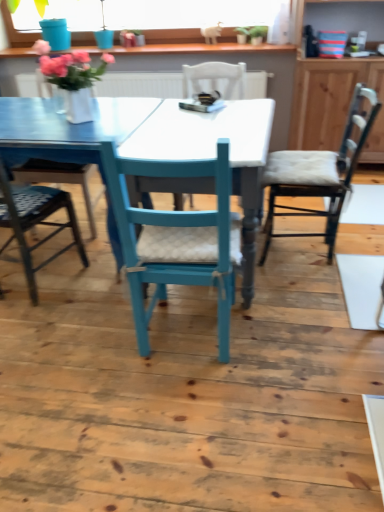
Question: Is matte blue swivel chair at left positioned in front of wooden cabinet at right?

Choices:
 (A) yes
 (B) no

Answer: (A)

Question: From the image's perspective, is matte blue swivel chair at left on top of wooden cabinet at right?

Choices:
 (A) no
 (B) yes

Answer: (A)

Question: Does matte blue swivel chair at left lie behind wooden cabinet at right?

Choices:
 (A) yes
 (B) no

Answer: (B)

Question: Can you confirm if matte blue swivel chair at left is shorter than wooden cabinet at right?

Choices:
 (A) yes
 (B) no

Answer: (A)

Question: Is matte blue swivel chair at left thinner than wooden cabinet at right?

Choices:
 (A) no
 (B) yes

Answer: (A)

Question: Is matte blue swivel chair at left not near wooden cabinet at right?

Choices:
 (A) no
 (B) yes

Answer: (B)

Question: From a real-world perspective, is matte blue swivel chair at left on wooden textured chair at right, which is the first chair in right-to-left order?

Choices:
 (A) yes
 (B) no

Answer: (A)

Question: Does matte blue swivel chair at left have a lesser height compared to wooden textured chair at right, which appears as the third chair when viewed from the left?

Choices:
 (A) yes
 (B) no

Answer: (B)

Question: Does matte blue swivel chair at left have a smaller size compared to wooden textured chair at right, which appears as the third chair when viewed from the left?

Choices:
 (A) yes
 (B) no

Answer: (B)

Question: Considering the relative sizes of matte blue swivel chair at left and wooden textured chair at right, which is the first chair in right-to-left order, in the image provided, is matte blue swivel chair at left wider than wooden textured chair at right, which is the first chair in right-to-left order,?

Choices:
 (A) yes
 (B) no

Answer: (A)

Question: From the image's perspective, is matte blue swivel chair at left below wooden textured chair at right, which appears as the third chair when viewed from the left?

Choices:
 (A) no
 (B) yes

Answer: (A)

Question: From a real-world perspective, is matte blue swivel chair at left physically below wooden textured chair at right, which is the first chair in right-to-left order?

Choices:
 (A) no
 (B) yes

Answer: (A)

Question: Does wooden textured chair at right, which is the first chair in right-to-left order, have a greater width compared to green matte plant at upper center?

Choices:
 (A) no
 (B) yes

Answer: (B)